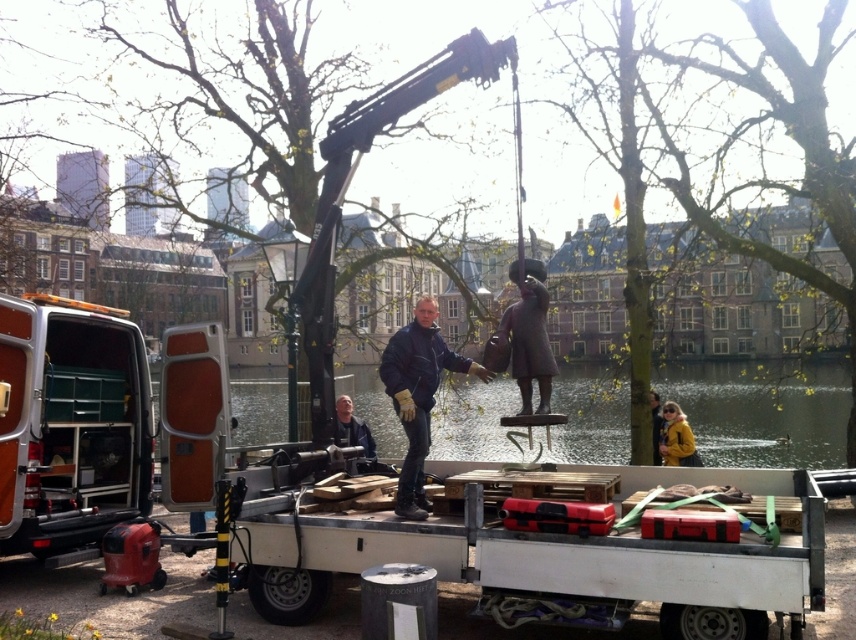
Question: Is white wooden trailer truck at center closer to camera compared to yellow matte jacket at lower right?

Choices:
 (A) no
 (B) yes

Answer: (B)

Question: Among these objects, which one is nearest to the camera?

Choices:
 (A) orange metallic van at left
 (B) yellow matte jacket at lower right

Answer: (A)

Question: Does bronze statue at center have a larger size compared to yellow matte jacket at lower right?

Choices:
 (A) no
 (B) yes

Answer: (B)

Question: Which of the following is the closest to the observer?

Choices:
 (A) green water at center
 (B) white wooden trailer truck at center

Answer: (B)

Question: Where is orange metallic van at left located in relation to bronze statue at center in the image?

Choices:
 (A) below
 (B) above

Answer: (A)

Question: Which of the following is the closest to the observer?

Choices:
 (A) bronze statue at center
 (B) yellow matte jacket at lower right
 (C) blue matte jacket at center
 (D) white wooden trailer truck at center

Answer: (D)